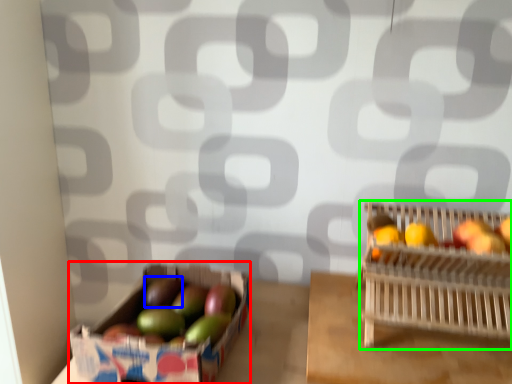
Question: Based on their relative distances, which object is nearer to cardboard box (highlighted by a red box)? Choose from apple (highlighted by a blue box) and basket (highlighted by a green box).

Choices:
 (A) apple
 (B) basket

Answer: (A)